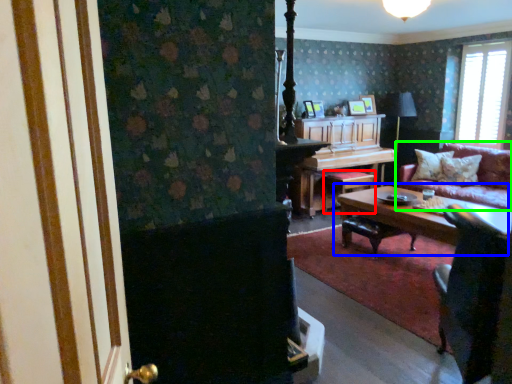
Question: Which object is positioned closest to stool (highlighted by a red box)? Select from coffee table (highlighted by a blue box) and studio couch (highlighted by a green box).

Choices:
 (A) coffee table
 (B) studio couch

Answer: (A)